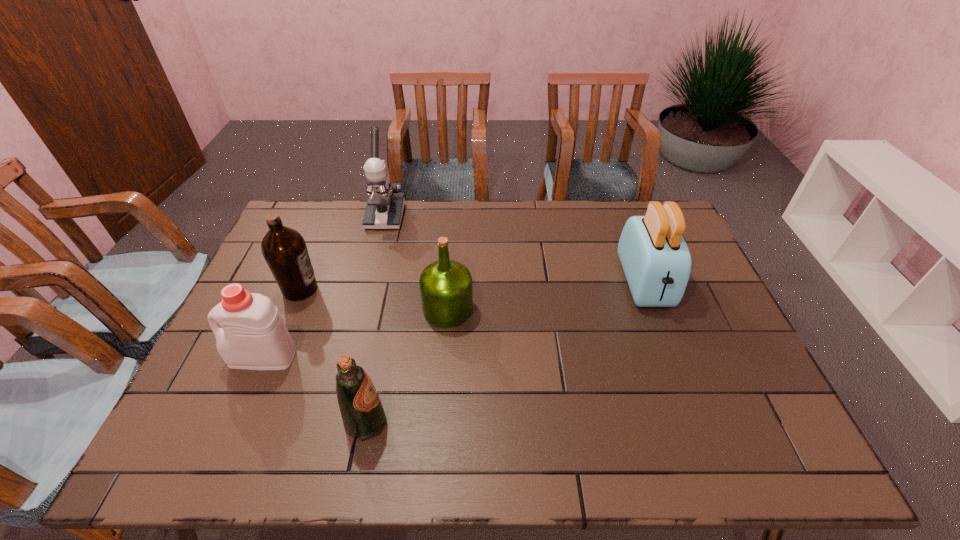
The image size is (960, 540). Find the location of `microscope`. microscope is located at coordinates (384, 209).

At what (x,y) coordinates should I click in order to perform the action: click on the rightmost object. Please return your answer as a coordinate pair (x, y). Looking at the image, I should click on (655, 258).

Find the location of `the leftmost olive oil`. the leftmost olive oil is located at coordinates (284, 249).

This screenshot has width=960, height=540. What are the coordinates of `the second object from right to left` in the screenshot? It's located at (446, 292).

I want to click on the second nearest object, so click(253, 336).

I want to click on the nearest object, so click(x=361, y=408).

Locate an element on the screen. This screenshot has width=960, height=540. the nearest olive oil is located at coordinates (361, 408).

You are a GUI agent. You are given a task and a screenshot of the screen. Output one action in this format:
    pyautogui.click(x=<x>, y=<y>)
    Task: Click on the vacant space located on the right of the microscope
    This screenshot has width=960, height=540.
    Given the screenshot: What is the action you would take?
    pyautogui.click(x=447, y=216)

At what (x,y) coordinates should I click in order to perform the action: click on vacant space located on the side of the rightmost object with the lever. Please return your answer as a coordinate pair (x, y). The width and height of the screenshot is (960, 540). Looking at the image, I should click on (674, 361).

This screenshot has height=540, width=960. In order to click on free space located 0.350m on the label of the leftmost olive oil in this screenshot , I will do `click(436, 289)`.